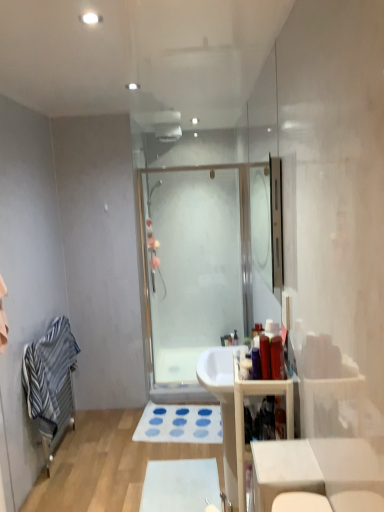
Question: From a real-world perspective, relative to white matte bath mat at lower center, the second bath mat in the back-to-front sequence, is blue fabric bath mat at lower center, which is counted as the second bath mat, starting from the bottom, vertically above or below?

Choices:
 (A) above
 (B) below

Answer: (A)

Question: Does point (134, 439) appear closer or farther from the camera than point (145, 472)?

Choices:
 (A) farther
 (B) closer

Answer: (A)

Question: Based on their relative distances, which object is nearer to the clear glass mirror at upper center?

Choices:
 (A) translucent plastic bottle at right, which ranks as the 1th toiletry in left-to-right order
 (B) blue fabric bath mat at lower center, the 1th bath mat when ordered from top to bottom
 (C) white glossy table at lower right
 (D) striped cotton bath towel at left
 (E) clear glass shower door at center

Answer: (E)

Question: Which object is the closest to the white glossy sink at center?

Choices:
 (A) clear glass mirror at upper center
 (B) clear glass shower door at center
 (C) wooden cabinet at right
 (D) striped cotton bath towel at left
 (E) white matte bath mat at lower center, the second bath mat in the back-to-front sequence

Answer: (C)